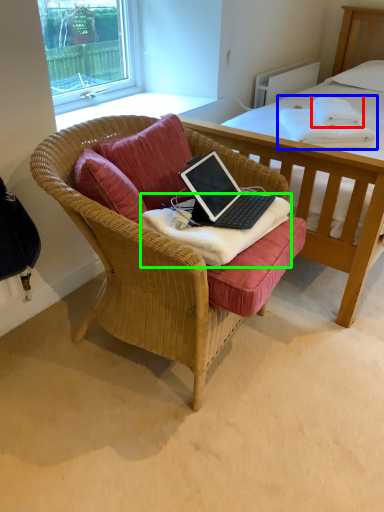
Question: Which object is positioned closest to cloth (highlighted by a red box)? Select from blanket (highlighted by a blue box) and blanket (highlighted by a green box).

Choices:
 (A) blanket
 (B) blanket

Answer: (A)